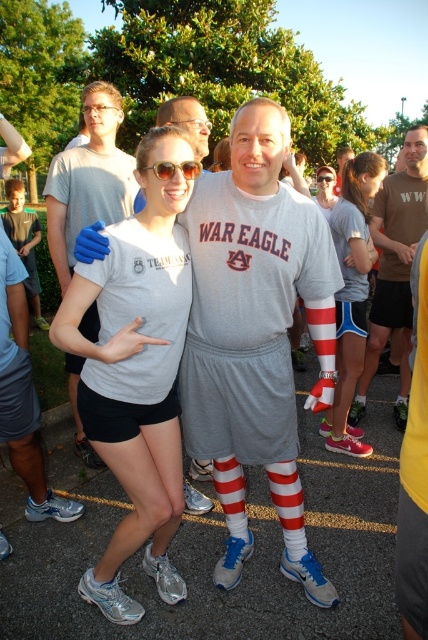
Does point (119, 106) come farther from viewer compared to point (324, 179)?

No, (119, 106) is closer to viewer.

Can you confirm if matte blue glove at upper left is wider than transparent plastic goggles at upper center?

Yes.

The height and width of the screenshot is (640, 428). I want to click on matte blue glove at upper left, so click(x=89, y=179).

Where is `matte blue glove at upper left`? The image size is (428, 640). matte blue glove at upper left is located at coordinates (89, 179).

Is gray cotton t-shirt at center bigger than sunglasses at center?

Correct, gray cotton t-shirt at center is larger in size than sunglasses at center.

Is point (285, 456) more distant than point (196, 164)?

Yes, point (285, 456) is behind point (196, 164).

Between point (246, 205) and point (148, 166), which one is positioned behind?

Positioned behind is point (246, 205).

Where is `gray cotton t-shirt at center`? This screenshot has width=428, height=640. gray cotton t-shirt at center is located at coordinates (255, 333).

Is point (187, 164) positioned in front of point (326, 182)?

Yes, it is.

Does point (187, 163) come closer to viewer compared to point (320, 179)?

Yes.

At what (x,y) coordinates should I click in order to perform the action: click on sunglasses at center. Please return your answer as a coordinate pair (x, y). The width and height of the screenshot is (428, 640). Looking at the image, I should click on (175, 170).